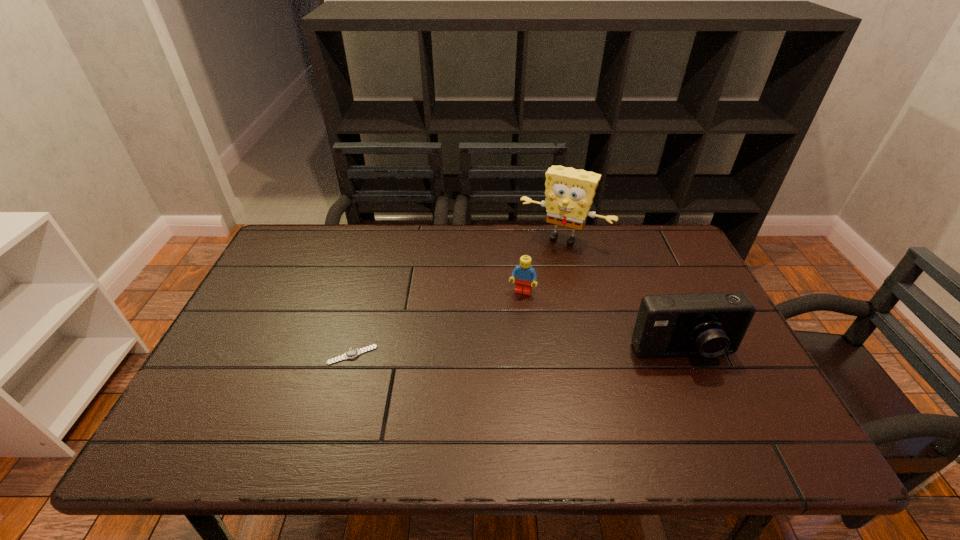
You are a GUI agent. You are given a task and a screenshot of the screen. Output one action in this format:
    pyautogui.click(x=<x>, y=<y>)
    Task: Click on the leftmost object
    The image size is (960, 540).
    Given the screenshot: What is the action you would take?
    pyautogui.click(x=352, y=353)

Locate an element on the screen. The height and width of the screenshot is (540, 960). the shortest object is located at coordinates (352, 353).

This screenshot has width=960, height=540. I want to click on the third shortest object, so click(709, 324).

You are a GUI agent. You are given a task and a screenshot of the screen. Output one action in this format:
    pyautogui.click(x=<x>, y=<y>)
    Task: Click on the third nearest object
    This screenshot has width=960, height=540.
    Given the screenshot: What is the action you would take?
    [x=524, y=273]

Locate an element on the screen. The width and height of the screenshot is (960, 540). Lego is located at coordinates (524, 273).

What are the coordinates of `the tallest object` in the screenshot? It's located at (569, 193).

Identify the location of the farthest object. (569, 193).

At what (x,y) coordinates should I click in order to perform the action: click on vacant area located 0.370m on the back of the watch. Please return your answer as a coordinate pair (x, y). Looking at the image, I should click on [x=380, y=255].

Identify the location of free region located on the face of the third tallest object. The image size is (960, 540). (483, 407).

The image size is (960, 540). What are the coordinates of `vacant space located on the face of the third tallest object` in the screenshot? It's located at (498, 360).